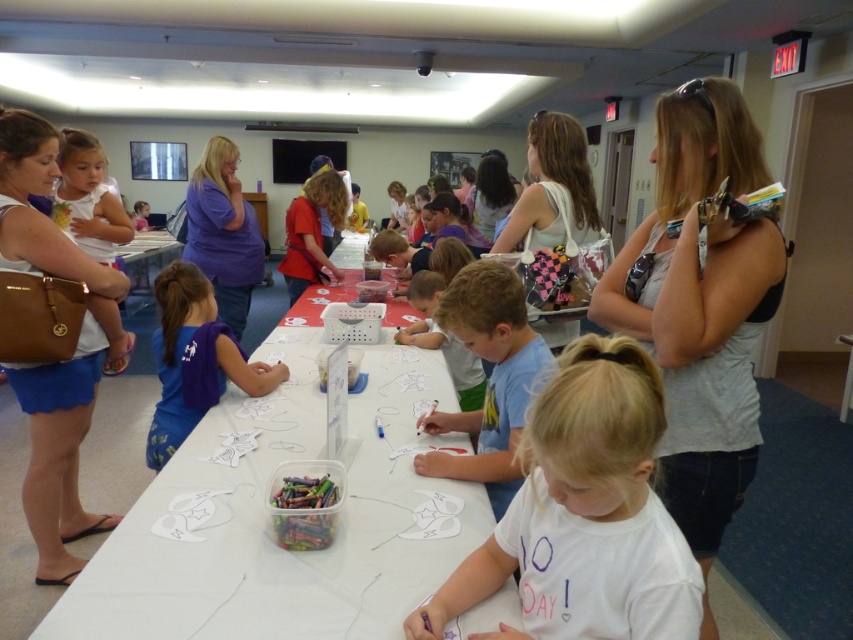
You are a photographer at the event and need to ensure both the blue cotton shirt at center and the light blue shirt at center are visible in the photo. Given their height difference, which shirt might you need to adjust to avoid blocking the other?

The blue cotton shirt at center is much taller than the light blue shirt at center, so you might need to adjust the blue cotton shirt at center to prevent it from blocking the shorter light blue shirt at center.

You are a participant in the craft activity at the table. You need to reach for the markers on the white paper table at center while standing next to the blue cotton shirt at center. Considering their heights, will you have to bend down or stand up to reach the markers?

The white paper table at center has a lesser height compared to the blue cotton shirt at center. Since the table is lower than the shirt, you would need to bend down to reach the markers on the white paper table at center.